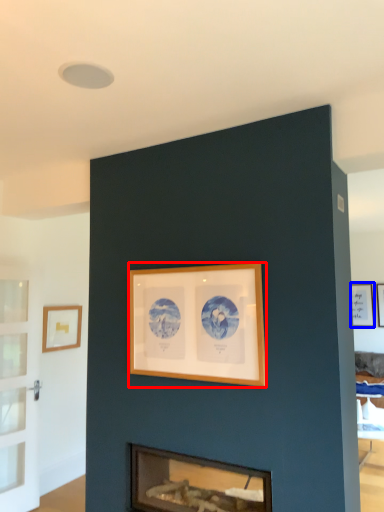
Question: Which point is further to the camera, picture frame (highlighted by a red box) or picture frame (highlighted by a blue box)?

Choices:
 (A) picture frame
 (B) picture frame

Answer: (B)